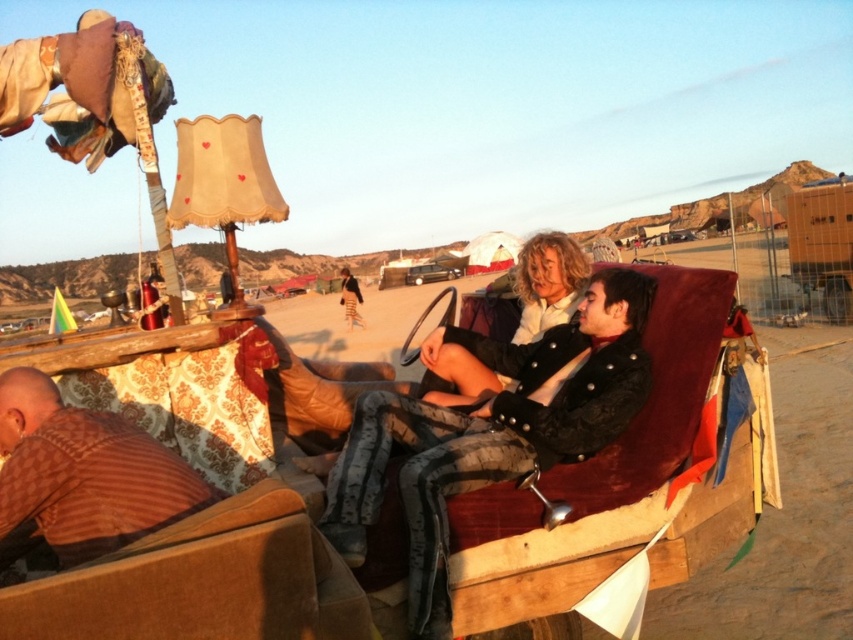
Between point (670, 536) and point (21, 488), which one is positioned behind?

The point (670, 536) is behind.

Who is higher up, velvet red couch at center or brown striped shirt at lower left?

brown striped shirt at lower left

Where is `velvet red couch at center`? Image resolution: width=853 pixels, height=640 pixels. velvet red couch at center is located at coordinates (610, 483).

Is brown striped shirt at lower left shorter than matte black jacket at center?

Yes, brown striped shirt at lower left is shorter than matte black jacket at center.

Which is more to the right, brown striped shirt at lower left or matte black jacket at center?

matte black jacket at center is more to the right.

You are a GUI agent. You are given a task and a screenshot of the screen. Output one action in this format:
    pyautogui.click(x=<x>, y=<y>)
    Task: Click on the brown striped shirt at lower left
    The height and width of the screenshot is (640, 853).
    Given the screenshot: What is the action you would take?
    pyautogui.click(x=84, y=474)

Which of these two, velvet red couch at center or velvet black jacket at center, stands shorter?

velvet black jacket at center is shorter.

Is point (743, 454) positioned in front of point (566, 452)?

No, (743, 454) is further to viewer.

I want to click on velvet red couch at center, so click(x=610, y=483).